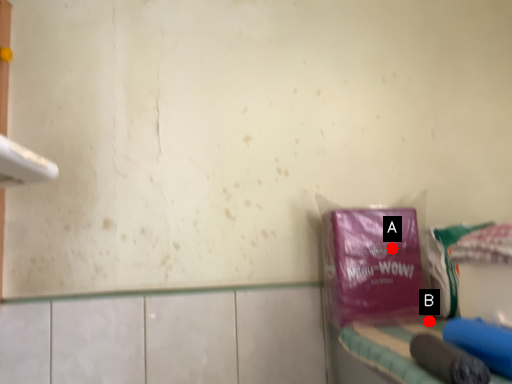
Question: Two points are circled on the image, labeled by A and B beside each circle. Which point appears farthest from the camera in this image?

Choices:
 (A) A is further
 (B) B is further

Answer: (B)